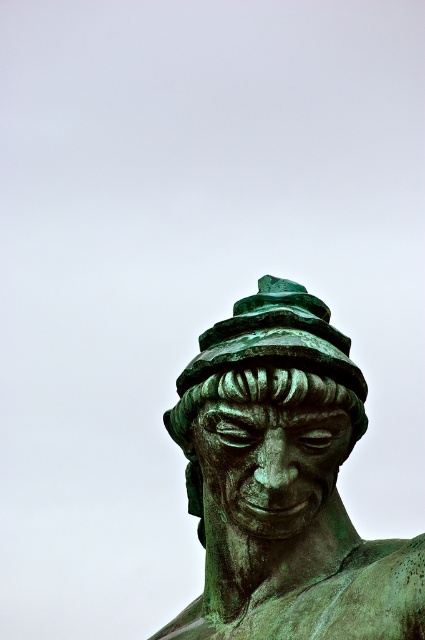
Does green patina statue at center have a lesser height compared to green patina hat at center?

Incorrect, green patina statue at center's height does not fall short of green patina hat at center's.

Does green patina statue at center come in front of green patina hat at center?

Yes, green patina statue at center is closer to the viewer.

You are a GUI agent. You are given a task and a screenshot of the screen. Output one action in this format:
    pyautogui.click(x=<x>, y=<y>)
    Task: Click on the green patina statue at center
    
    Given the screenshot: What is the action you would take?
    pyautogui.click(x=283, y=483)

Locate an element on the screen. green patina statue at center is located at coordinates (283, 483).